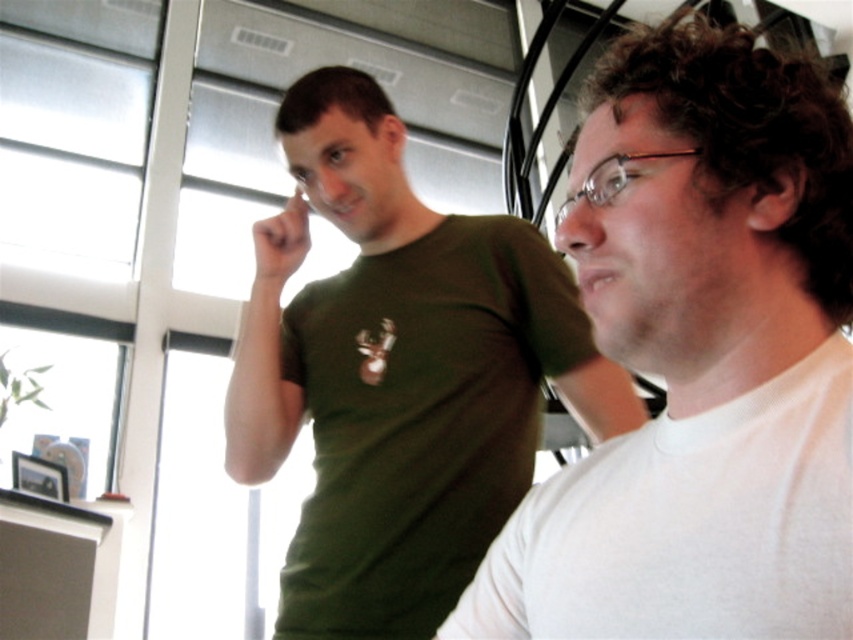
Question: Which point is farther to the camera?

Choices:
 (A) green matte t-shirt at upper left
 (B) white matte shirt at right

Answer: (A)

Question: Which point is closer to the camera taking this photo?

Choices:
 (A) (490, 371)
 (B) (743, 204)

Answer: (B)

Question: Is white matte shirt at right thinner than green matte t-shirt at upper left?

Choices:
 (A) yes
 (B) no

Answer: (A)

Question: Which point is farther to the camera?

Choices:
 (A) green matte t-shirt at upper left
 (B) white matte shirt at right

Answer: (A)

Question: Can you confirm if white matte shirt at right is bigger than green matte t-shirt at upper left?

Choices:
 (A) yes
 (B) no

Answer: (B)

Question: Does white matte shirt at right appear on the left side of green matte t-shirt at upper left?

Choices:
 (A) no
 (B) yes

Answer: (A)